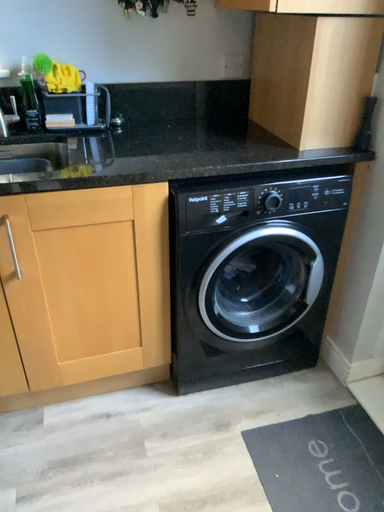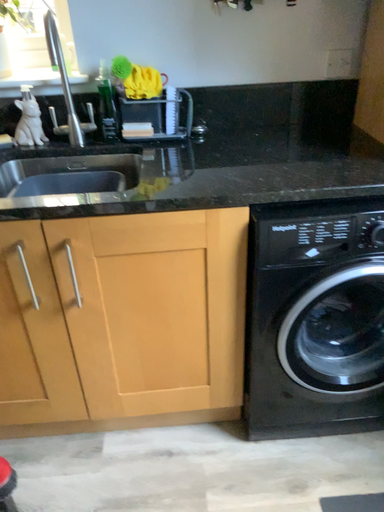
Question: Which way did the camera rotate in the video?

Choices:
 (A) rotated right
 (B) rotated left

Answer: (B)